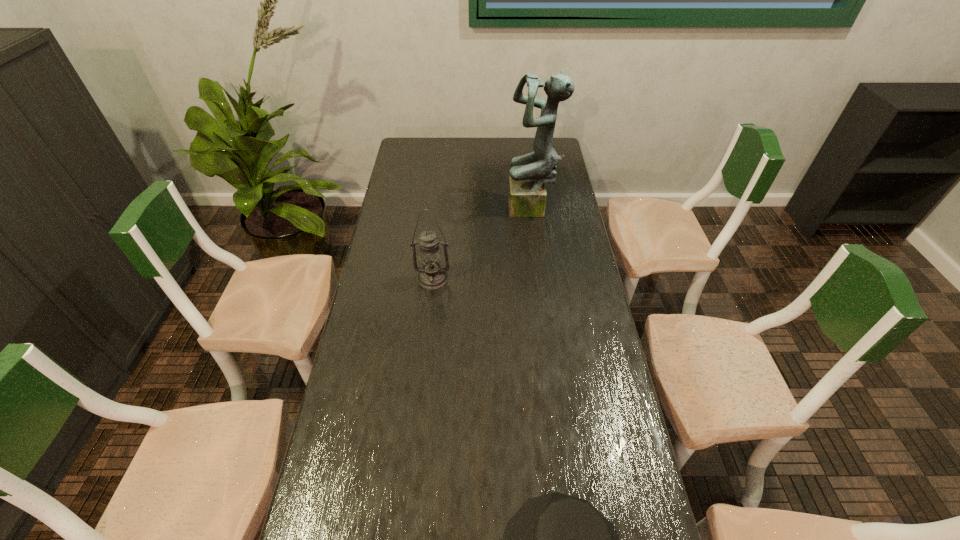
Identify the location of the farthest object. (527, 194).

Where is `the tallest object`? This screenshot has height=540, width=960. the tallest object is located at coordinates (527, 194).

Where is `the second farthest object`? Image resolution: width=960 pixels, height=540 pixels. the second farthest object is located at coordinates click(x=432, y=275).

At what (x,y) coordinates should I click in order to perform the action: click on oil lamp. Please return your answer as a coordinate pair (x, y). This screenshot has width=960, height=540. Looking at the image, I should click on (432, 275).

The height and width of the screenshot is (540, 960). I want to click on free space located 0.050m on the face of the sculpture, so click(x=494, y=210).

This screenshot has height=540, width=960. What are the coordinates of `blank space located on the face of the sculpture` in the screenshot? It's located at (414, 210).

Find the location of a particular element. The width and height of the screenshot is (960, 540). free region located 0.300m on the face of the sculpture is located at coordinates (435, 210).

This screenshot has width=960, height=540. Find the location of `vacant area located 0.180m on the back of the oil lamp`. vacant area located 0.180m on the back of the oil lamp is located at coordinates (437, 235).

Where is `object at the right edge`? The image size is (960, 540). object at the right edge is located at coordinates (527, 194).

Find the location of a particular element. The width and height of the screenshot is (960, 540). free space at the far edge of the desktop is located at coordinates (495, 154).